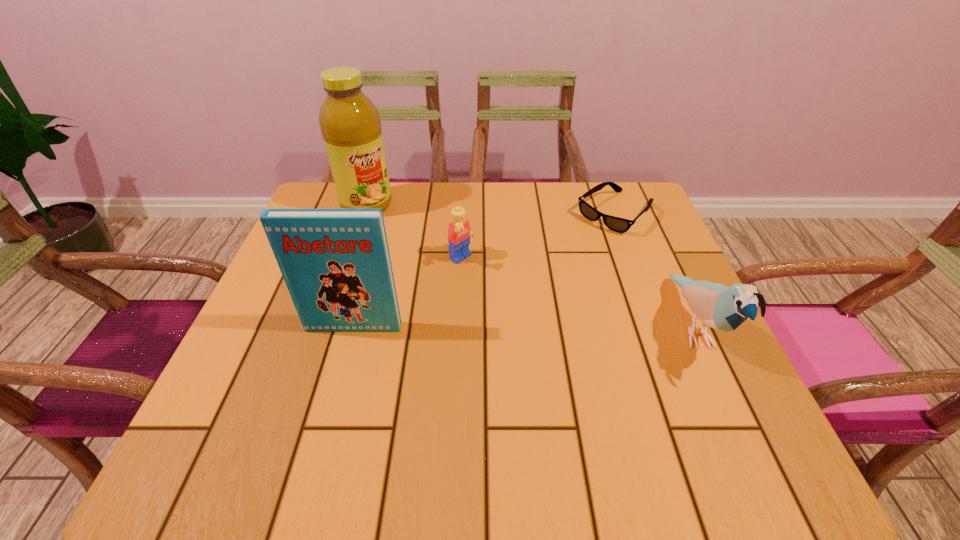
At what (x,y) coordinates should I click in order to perform the action: click on object that is the closest to the bird. Please return your answer as a coordinate pair (x, y). The width and height of the screenshot is (960, 540). Looking at the image, I should click on (617, 224).